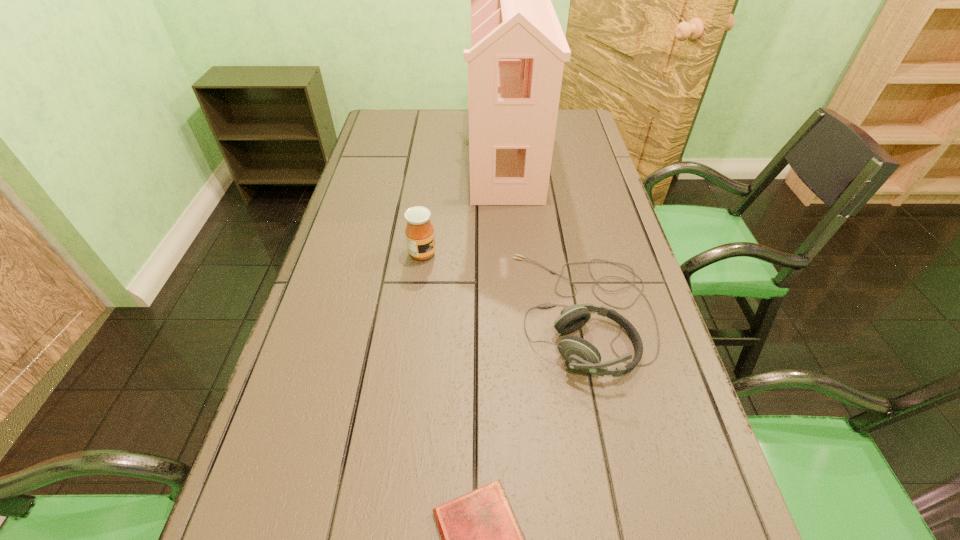
Locate an element on the screen. The image size is (960, 540). vacant area located 0.090m on the outer surface of the headset is located at coordinates (476, 312).

Where is `vacant space located on the outer surface of the headset`? The width and height of the screenshot is (960, 540). vacant space located on the outer surface of the headset is located at coordinates (485, 312).

At what (x,y) coordinates should I click in order to perform the action: click on object that is at the far edge. Please return your answer as a coordinate pair (x, y). The height and width of the screenshot is (540, 960). Looking at the image, I should click on (515, 64).

At what (x,y) coordinates should I click in order to perform the action: click on object situated at the right edge. Please return your answer as a coordinate pair (x, y). This screenshot has width=960, height=540. Looking at the image, I should click on (580, 354).

In the image, there is a desktop. Where is `vacant space at the far edge`? The width and height of the screenshot is (960, 540). vacant space at the far edge is located at coordinates (430, 124).

You are a GUI agent. You are given a task and a screenshot of the screen. Output one action in this format:
    pyautogui.click(x=<x>, y=<y>)
    Task: Click on the vacant space at the left edge
    
    Given the screenshot: What is the action you would take?
    pyautogui.click(x=352, y=185)

In the image, there is a desktop. What are the coordinates of `vacant space at the right edge` in the screenshot? It's located at (588, 160).

What are the coordinates of `vacant space at the far left corner of the desktop` in the screenshot? It's located at (403, 141).

This screenshot has height=540, width=960. Identify the location of free region at the far right corner of the desktop. (586, 133).

What are the coordinates of `free space between the tallest object and the honey` in the screenshot? It's located at (464, 206).